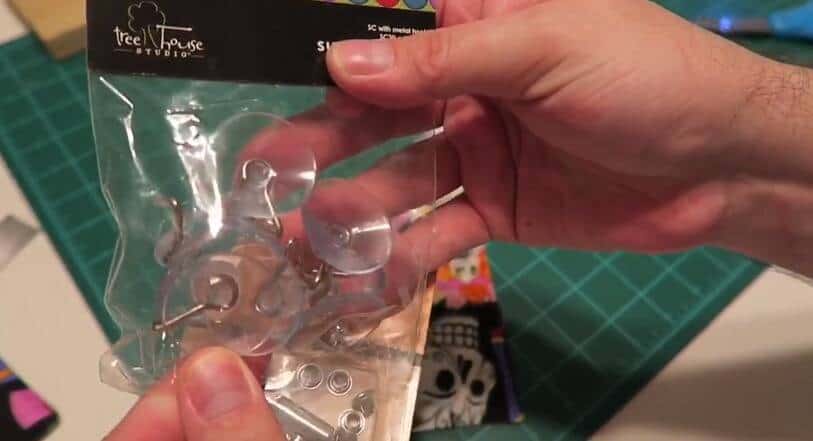
At what (x,y) coordinates should I click in order to perform the action: click on suction cups. Please return your answer as a coordinate pair (x, y). The height and width of the screenshot is (441, 813). Looking at the image, I should click on pyautogui.click(x=300, y=160), pyautogui.click(x=364, y=215), pyautogui.click(x=250, y=288), pyautogui.click(x=285, y=288).